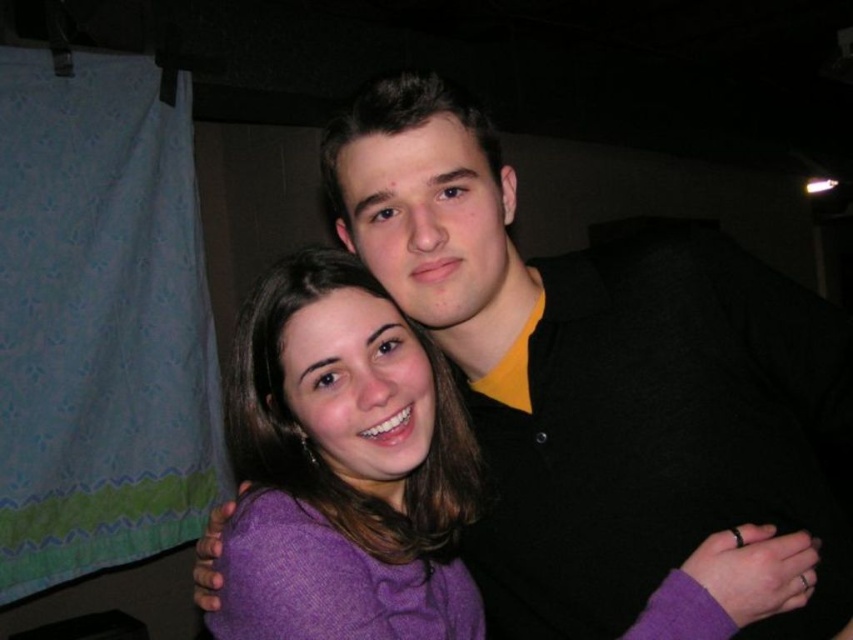
Does black matte shirt at upper center come in front of purple wool sweater at center?

That is False.

Is black matte shirt at upper center to the left of purple wool sweater at center from the viewer's perspective?

In fact, black matte shirt at upper center is to the right of purple wool sweater at center.

Which is behind, point (695, 497) or point (361, 541)?

The point (695, 497) is more distant.

Where is `black matte shirt at upper center`? The image size is (853, 640). black matte shirt at upper center is located at coordinates (601, 378).